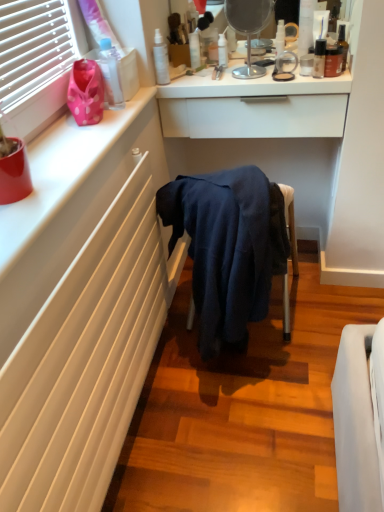
Locate an element on the screen. The width and height of the screenshot is (384, 512). vacant space that is to the left of translucent plastic spray bottle at upper center, marked as the fifth toiletry in a right-to-left arrangement is located at coordinates (191, 77).